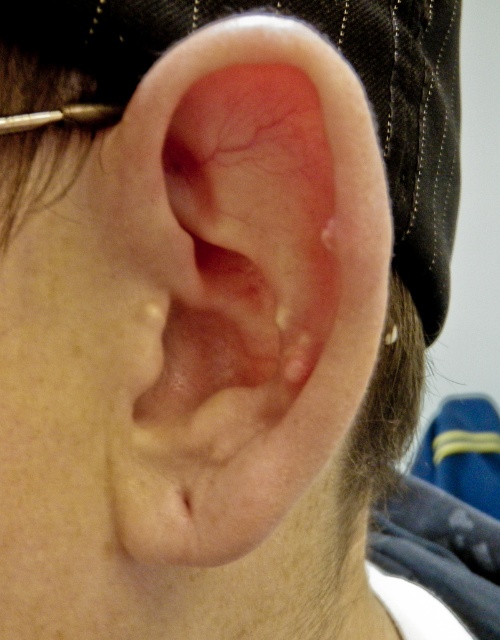
Can you confirm if pink flesh-colored ear at center is positioned below silver metallic earring at upper left?

Incorrect, pink flesh-colored ear at center is not positioned below silver metallic earring at upper left.

Does pink flesh-colored ear at center have a lesser height compared to silver metallic earring at upper left?

No.

Who is more forward, [139,346] or [388,339]?

Point [139,346]

At what (x,y) coordinates should I click in order to perform the action: click on pink flesh-colored ear at center. Please return your answer as a coordinate pair (x, y). Looking at the image, I should click on [238, 284].